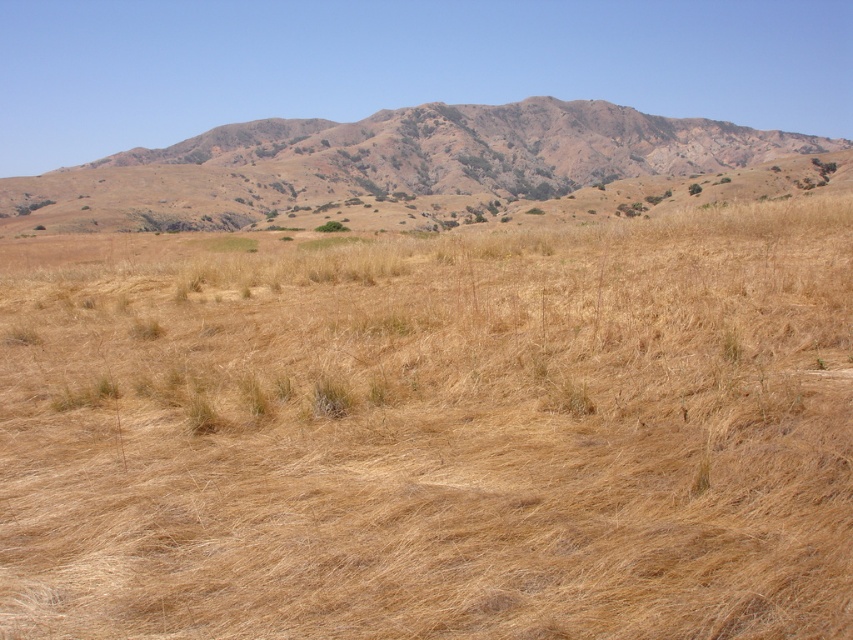
Between point (750, 321) and point (554, 131), which one is positioned behind?

Positioned behind is point (554, 131).

In the scene shown: Is dry grass at center taller than brown/dry grassy at upper center?

No, dry grass at center is not taller than brown/dry grassy at upper center.

Who is more forward, (135, 298) or (459, 109)?

Point (135, 298) is in front.

Find the location of a particular element. The width and height of the screenshot is (853, 640). dry grass at center is located at coordinates (433, 432).